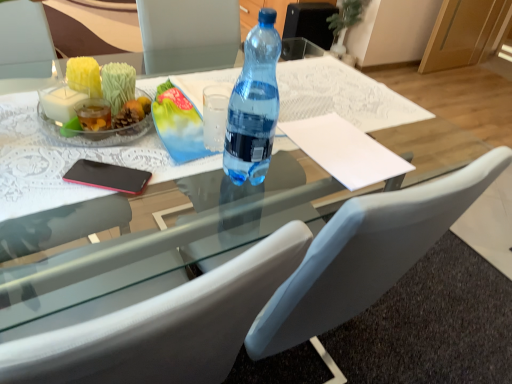
Locate an element on the screen. The width and height of the screenshot is (512, 384). free space behind white paper at center is located at coordinates (360, 114).